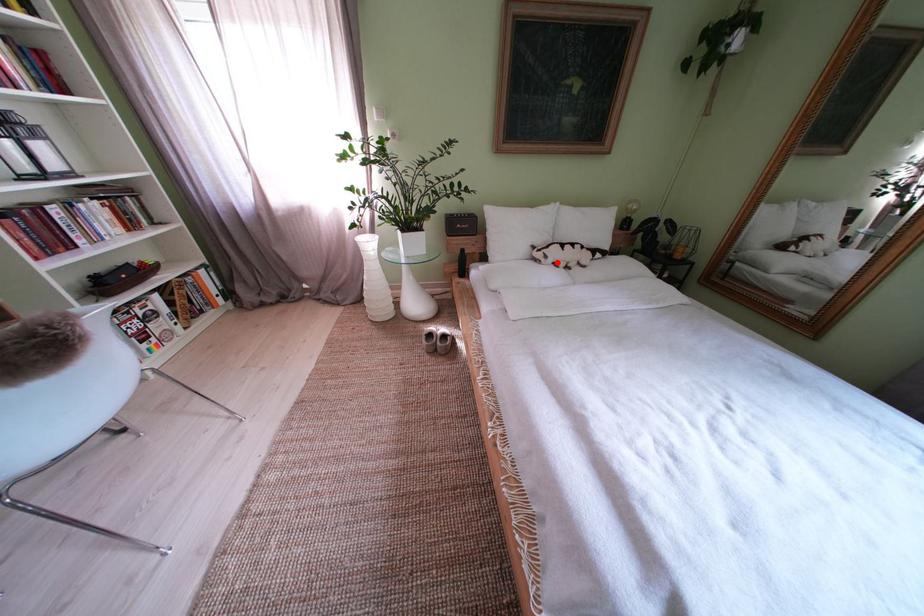
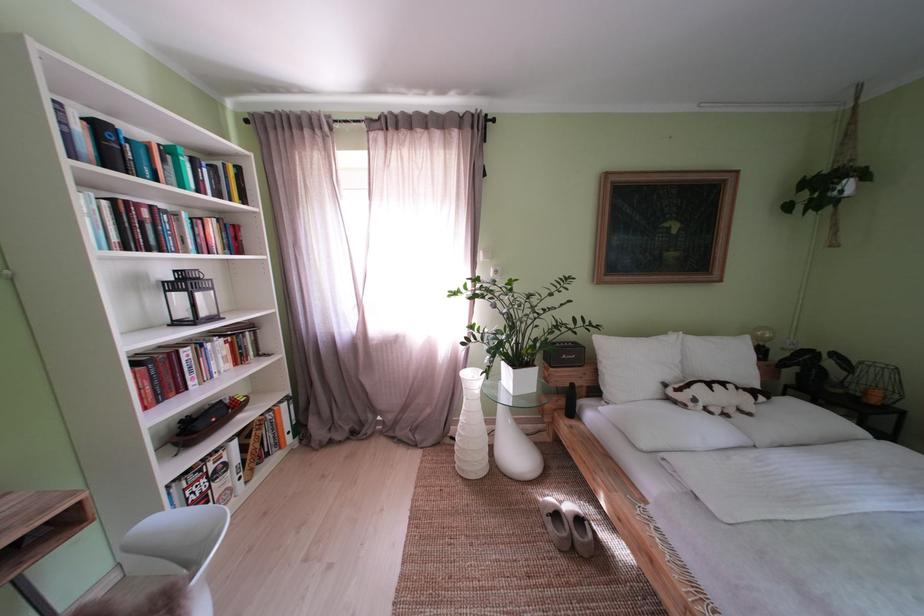
Find the pixel in the second image that matches the highlighted location in the first image.

(706, 406)